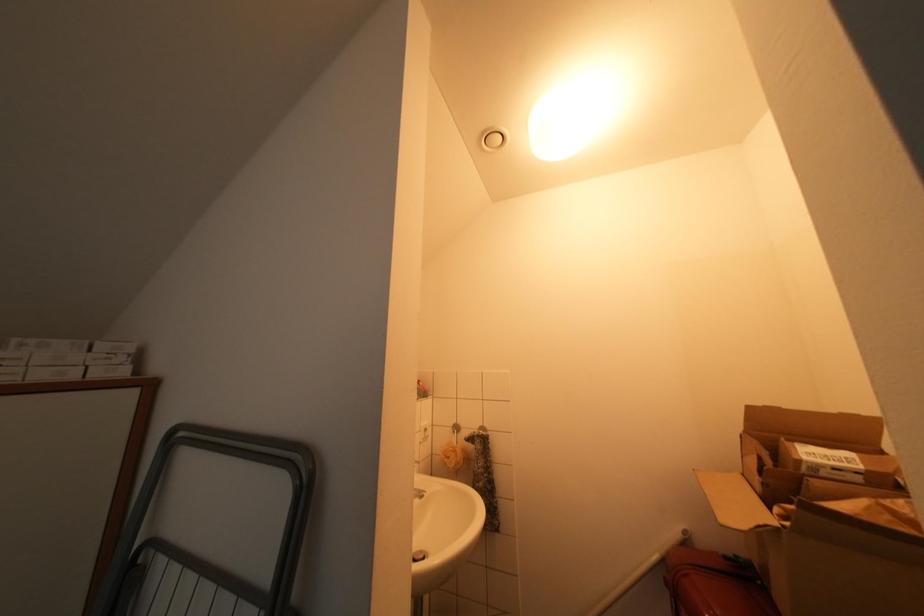
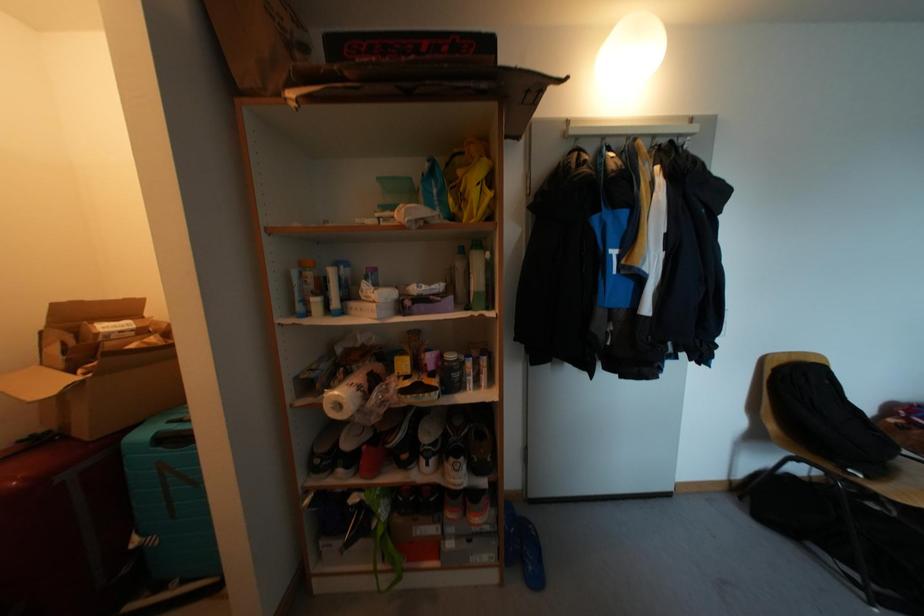
Question: The images are taken continuously from a first-person perspective. In which direction is your viewpoint rotating?

Choices:
 (A) Left
 (B) Right
 (C) Up
 (D) Down

Answer: (B)